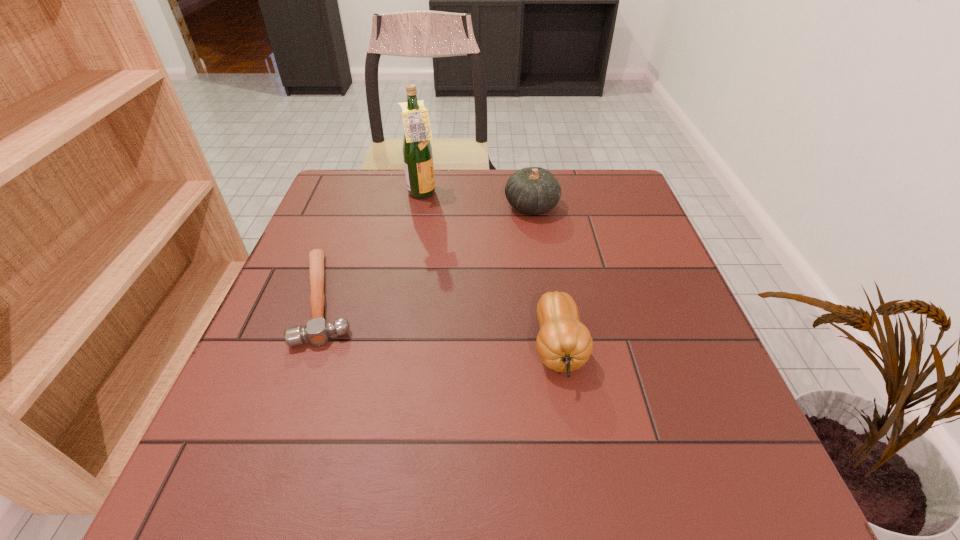
The height and width of the screenshot is (540, 960). I want to click on the third object from right to left, so click(417, 151).

Locate an element on the screen. The width and height of the screenshot is (960, 540). liquor is located at coordinates (417, 151).

At what (x,y) coordinates should I click in order to perform the action: click on the farther gourd. Please return your answer as a coordinate pair (x, y). This screenshot has width=960, height=540. Looking at the image, I should click on (532, 190).

What are the coordinates of `the shorter gourd` in the screenshot? It's located at (564, 344).

Find the location of a particular element. Image resolution: width=960 pixels, height=540 pixels. the third tallest object is located at coordinates (564, 344).

You are a GUI agent. You are given a task and a screenshot of the screen. Output one action in this format:
    pyautogui.click(x=<x>, y=<y>)
    Task: Click on the shortest object
    This screenshot has height=540, width=960.
    Given the screenshot: What is the action you would take?
    pyautogui.click(x=317, y=331)

This screenshot has height=540, width=960. What are the coordinates of `the leftmost object` in the screenshot? It's located at (317, 331).

Locate an element on the screen. free space located on the front-facing side of the liquor is located at coordinates (495, 194).

Locate an element on the screen. Image resolution: width=960 pixels, height=540 pixels. free space located on the right of the farther gourd is located at coordinates (630, 206).

Locate an element on the screen. free space located 0.150m on the stem side of the shorter gourd is located at coordinates (580, 480).